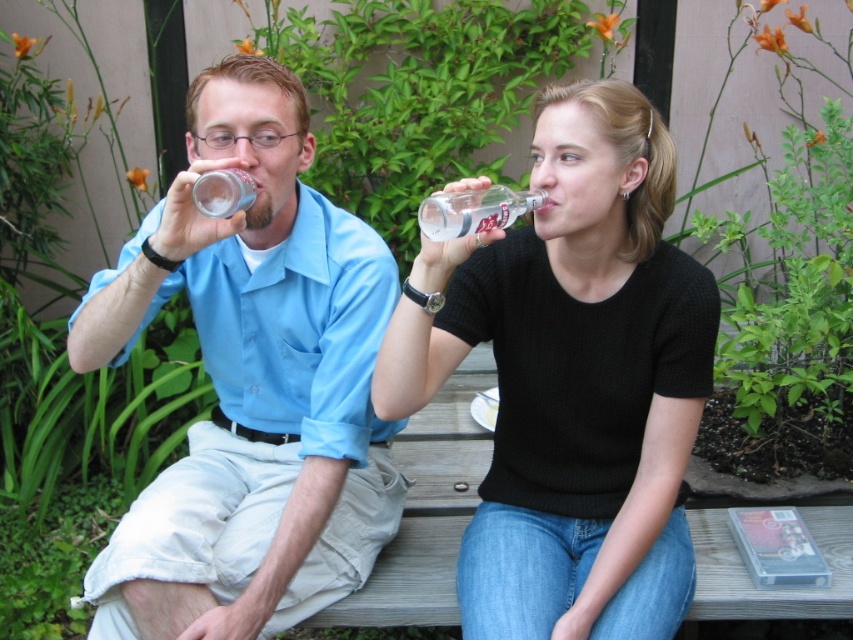
You are a photographer trying to capture a closeup of the clear plastic bottle at upper center and the clear glass bottle at upper center. Which one should you focus on first if you want to start with the one that is more to the left?

The clear glass bottle at upper center is more to the left than the clear plastic bottle at upper center, so you should focus on the clear glass bottle at upper center first.

You are a photographer taking a picture of the two people sitting on the bench. You need to focus on the matte plastic bottle at left and the clear plastic bottle at upper center. Which bottle is located to the left of the other?

The matte plastic bottle at left is positioned on the left side of clear plastic bottle at upper center.